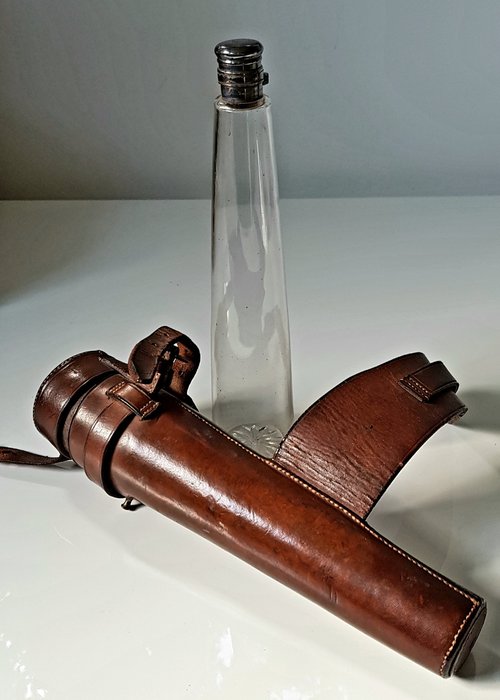
You are a GUI agent. You are given a task and a screenshot of the screen. Output one action in this format:
    pyautogui.click(x=<x>, y=<y>)
    Task: Click on the surface
    Image resolution: width=500 pixels, height=700 pixels.
    Given the screenshot: What is the action you would take?
    pyautogui.click(x=237, y=637)